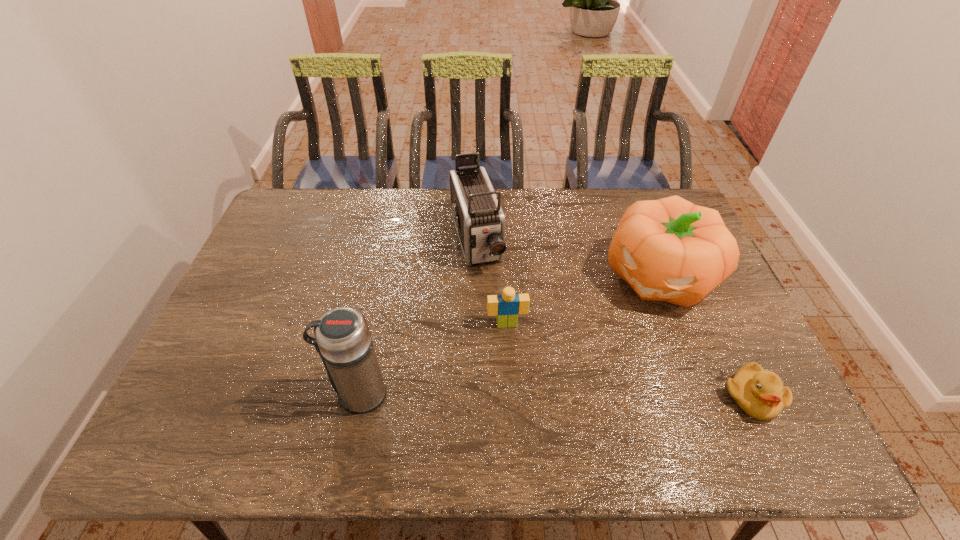
The width and height of the screenshot is (960, 540). Identify the location of vacant spot on the desktop that is between the thermos bottle and the shortest object and is positioned on the face of the second shortest object. (516, 395).

Identify the location of free spot on the desktop that is between the thermos bottle and the duckling and is positioned at the lens of the camcorder. The width and height of the screenshot is (960, 540). (527, 395).

Find the location of a particular element. free spot on the desktop that is between the leftmost object and the shortest object and is positioned on the carved face of the pumpkin is located at coordinates (572, 396).